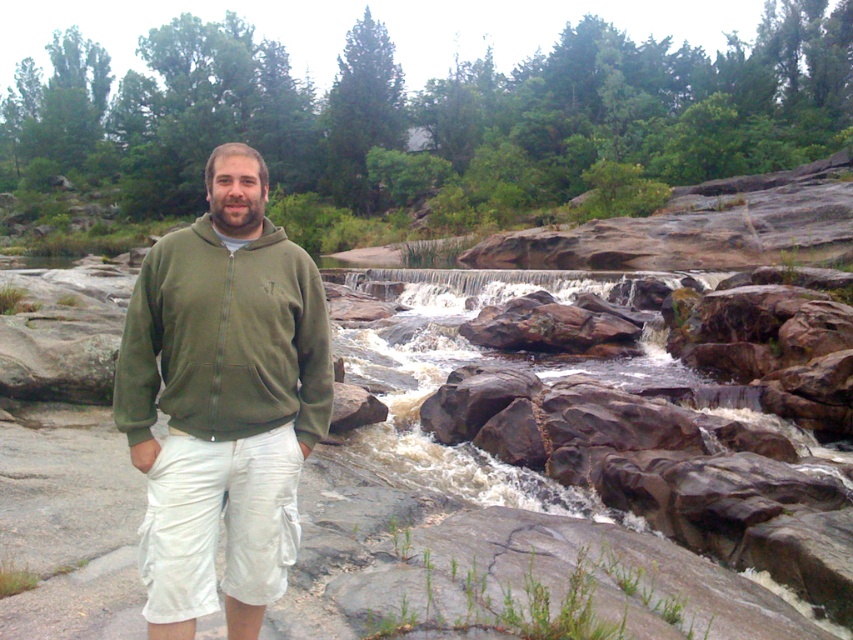
Is point (114, 378) more distant than point (206, 328)?

That is True.

The width and height of the screenshot is (853, 640). Find the location of `green fleece jacket at center`. green fleece jacket at center is located at coordinates (223, 401).